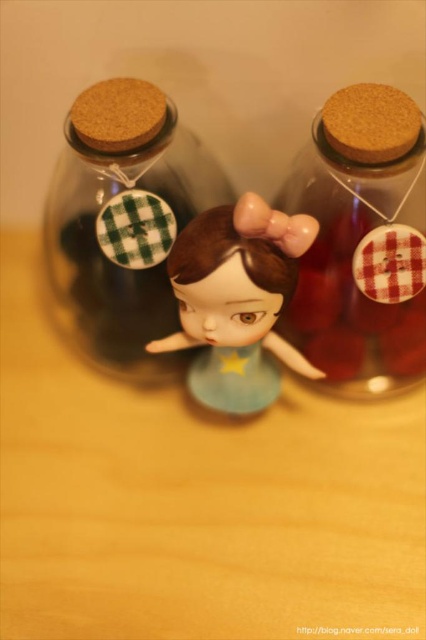
How much distance is there between red plaid cork at right and transparent glass jar at center?

The distance of red plaid cork at right from transparent glass jar at center is 26.94 centimeters.

Who is taller, red plaid cork at right or transparent glass jar at center?

With more height is transparent glass jar at center.

Consider the image. Who is more forward, (339, 141) or (178, 154)?

Point (339, 141) is in front.

The height and width of the screenshot is (640, 426). In order to click on red plaid cork at right in this screenshot , I will do `click(362, 243)`.

What do you see at coordinates (362, 243) in the screenshot? I see `red plaid cork at right` at bounding box center [362, 243].

Who is more distant from viewer, (391, 195) or (311, 221)?

The point (391, 195) is more distant.

The height and width of the screenshot is (640, 426). Describe the element at coordinates (362, 243) in the screenshot. I see `red plaid cork at right` at that location.

Find the location of a particular element. red plaid cork at right is located at coordinates (362, 243).

Which is more to the left, transparent glass jar at center or matte plastic doll at center?

Positioned to the left is transparent glass jar at center.

Can you confirm if transparent glass jar at center is bigger than matte plastic doll at center?

Yes, transparent glass jar at center is bigger than matte plastic doll at center.

Locate an element on the screen. transparent glass jar at center is located at coordinates (123, 221).